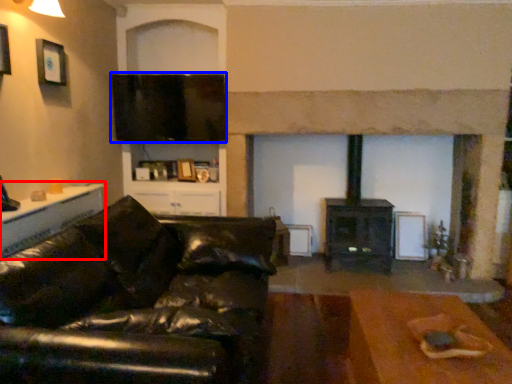
Question: Which of the following is the farthest to the observer, table (highlighted by a red box) or window screen (highlighted by a blue box)?

Choices:
 (A) table
 (B) window screen

Answer: (B)